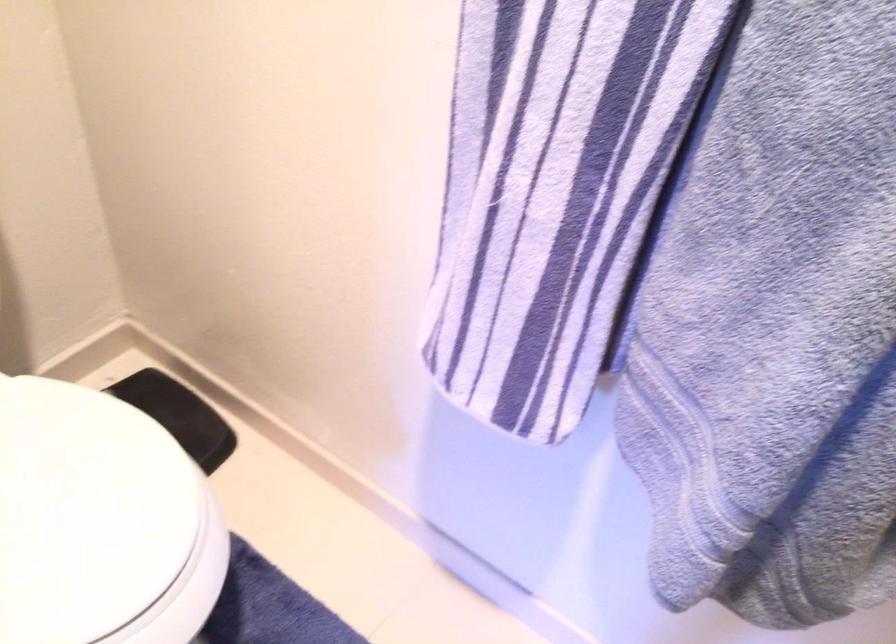
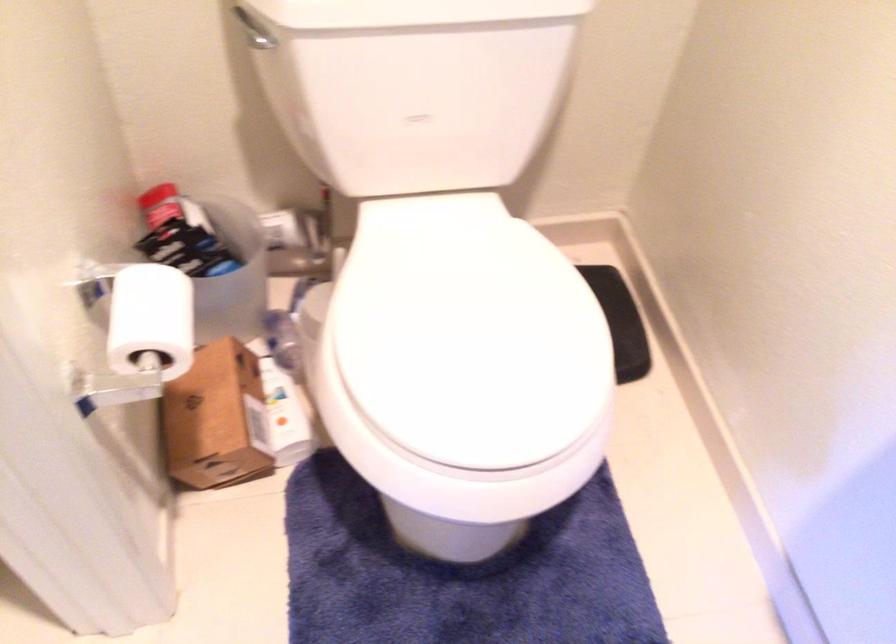
Question: The camera is either moving clockwise (left) or counter-clockwise (right) around the object. The first image is from the beginning of the video and the second image is from the end. Is the camera moving left or right when shooting the video?

Choices:
 (A) Left
 (B) Right

Answer: (B)